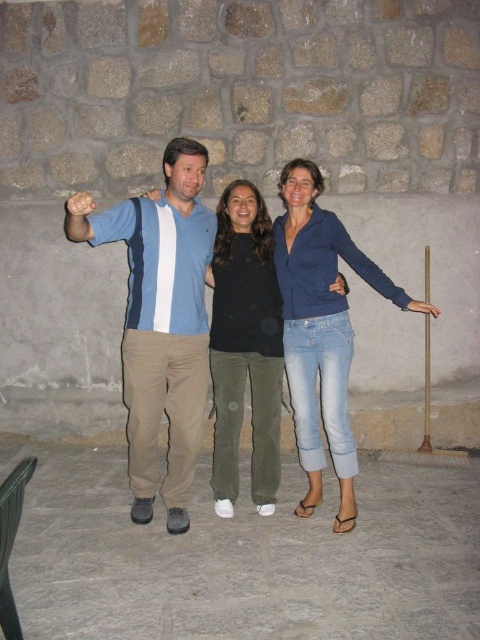
You are a photographer setting up a photo shoot in the described scene. You need to position a 1.5 meter tall backdrop behind the subjects. Considering the height of the blue denim jeans at center and the blue smooth shirt at right, will the backdrop be tall enough to cover both subjects from head to toe? Explain your reasoning.

The blue denim jeans at center is taller than the blue smooth shirt at right. Since the backdrop is 1.5 meters tall, it will only be sufficient if both subjects are shorter than 1.5 meters. However, since the blue denim jeans at center is taller than the blue smooth shirt at right, and assuming the blue denim jeans at center is the taller one, the backdrop may not be tall enough to cover the entire height of the taller subject. Therefore, the backdrop might not cover both subjects fully from head to toe.

You are a photographer trying to capture a group photo of the three people in the scene. You want to ensure that the blue striped shirt at center and the blue smooth shirt at right are both visible in the frame. Based on their positions, which side of the frame should you focus on to include both?

The blue striped shirt at center is positioned on the left side of the blue smooth shirt at right. To include both in the frame, focus on the central area where they are positioned relative to each other.

You are a photographer setting up a tripod in the middle of the room. You have two objects in your viewfinder, the smooth stone floor at center and the blue denim jeans at center. Which object is wider from your perspective?

The smooth stone floor at center is wider than the blue denim jeans at center according to the description.